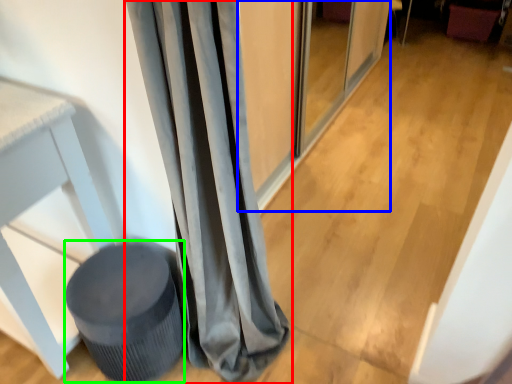
Question: Which object is the farthest from curtain (highlighted by a red box)? Choose among these: screen door (highlighted by a blue box) or music stool (highlighted by a green box).

Choices:
 (A) screen door
 (B) music stool

Answer: (A)